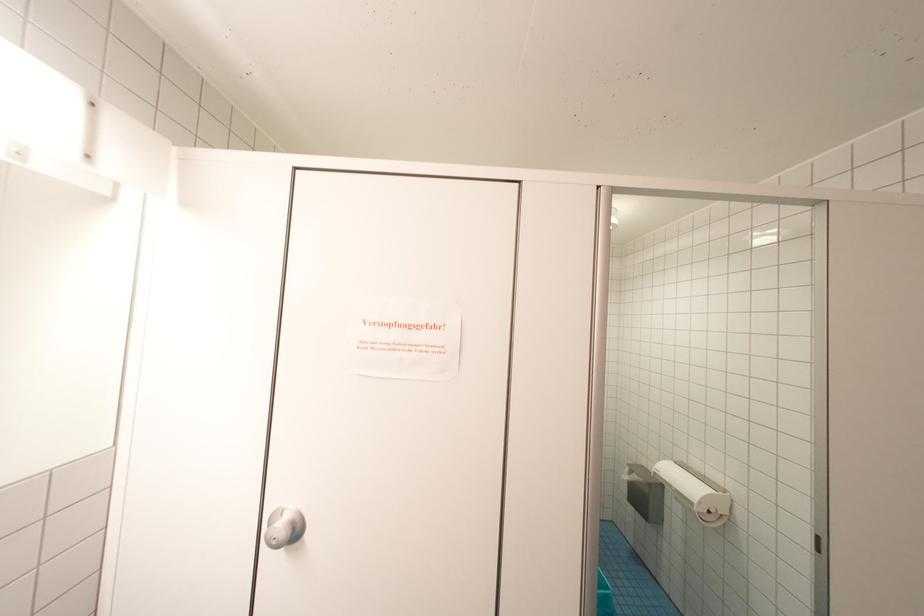
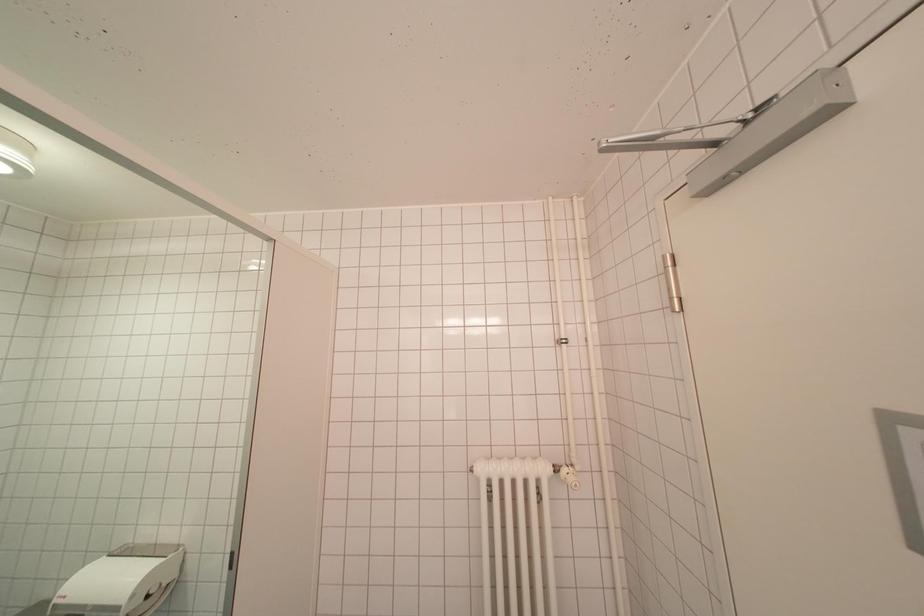
Question: How did the camera likely rotate?

Choices:
 (A) Left
 (B) Right
 (C) Up
 (D) Down

Answer: (B)